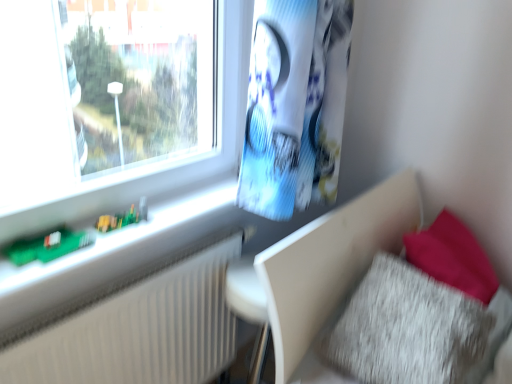
Question: From a real-world perspective, does white textured radiator at left stand above green circuit board at left?

Choices:
 (A) yes
 (B) no

Answer: (B)

Question: Is white textured radiator at left facing away from green circuit board at left?

Choices:
 (A) yes
 (B) no

Answer: (B)

Question: From a real-world perspective, is white textured radiator at left positioned under green circuit board at left based on gravity?

Choices:
 (A) yes
 (B) no

Answer: (A)

Question: Can you confirm if white textured radiator at left is shorter than green circuit board at left?

Choices:
 (A) yes
 (B) no

Answer: (B)

Question: From the image's perspective, is white textured radiator at left under green circuit board at left?

Choices:
 (A) no
 (B) yes

Answer: (B)

Question: Considering the positions of fuzzy fabric pillow at lower right and white textured radiator at left in the image, is fuzzy fabric pillow at lower right bigger or smaller than white textured radiator at left?

Choices:
 (A) small
 (B) big

Answer: (B)

Question: Considering their positions, is fuzzy fabric pillow at lower right located in front of or behind white textured radiator at left?

Choices:
 (A) front
 (B) behind

Answer: (A)

Question: Considering the positions of point (326, 359) and point (37, 362), is point (326, 359) closer or farther from the camera than point (37, 362)?

Choices:
 (A) closer
 (B) farther

Answer: (B)

Question: Considering the positions of fuzzy fabric pillow at lower right and white textured radiator at left in the image, is fuzzy fabric pillow at lower right taller or shorter than white textured radiator at left?

Choices:
 (A) tall
 (B) short

Answer: (B)

Question: From their relative heights in the image, would you say fuzzy fabric pillow at lower right is taller or shorter than green plastic toy at lower left?

Choices:
 (A) short
 (B) tall

Answer: (B)

Question: Is fuzzy fabric pillow at lower right in front of or behind green plastic toy at lower left in the image?

Choices:
 (A) front
 (B) behind

Answer: (A)

Question: Considering the positions of point (398, 278) and point (99, 228), is point (398, 278) closer or farther from the camera than point (99, 228)?

Choices:
 (A) farther
 (B) closer

Answer: (A)

Question: From a real-world perspective, is fuzzy fabric pillow at lower right physically located above or below green plastic toy at lower left?

Choices:
 (A) above
 (B) below

Answer: (B)

Question: From a real-world perspective, is white textured radiator at left physically located above or below fuzzy fabric pillow at lower right?

Choices:
 (A) below
 (B) above

Answer: (A)

Question: Is white textured radiator at left bigger or smaller than fuzzy fabric pillow at lower right?

Choices:
 (A) big
 (B) small

Answer: (B)